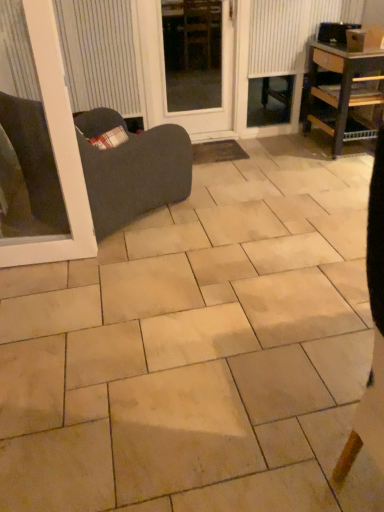
Question: From the image's perspective, does brown woven mat at center appear lower than wooden shelf at right?

Choices:
 (A) yes
 (B) no

Answer: (A)

Question: Is brown woven mat at center taller than wooden shelf at right?

Choices:
 (A) no
 (B) yes

Answer: (A)

Question: Is wooden shelf at right at the back of brown woven mat at center?

Choices:
 (A) yes
 (B) no

Answer: (B)

Question: Is brown woven mat at center not close to wooden shelf at right?

Choices:
 (A) no
 (B) yes

Answer: (A)

Question: Can you confirm if brown woven mat at center is positioned to the right of wooden shelf at right?

Choices:
 (A) no
 (B) yes

Answer: (A)

Question: Visually, is white textured radiator at upper right positioned to the left or to the right of wooden shelf at right?

Choices:
 (A) left
 (B) right

Answer: (A)

Question: Is white textured radiator at upper right wider or thinner than wooden shelf at right?

Choices:
 (A) thin
 (B) wide

Answer: (A)

Question: Is white textured radiator at upper right inside or outside of wooden shelf at right?

Choices:
 (A) outside
 (B) inside

Answer: (A)

Question: From their relative heights in the image, would you say white textured radiator at upper right is taller or shorter than wooden shelf at right?

Choices:
 (A) tall
 (B) short

Answer: (B)

Question: Considering the positions of wooden shelf at right and white textured radiator at upper right in the image, is wooden shelf at right taller or shorter than white textured radiator at upper right?

Choices:
 (A) tall
 (B) short

Answer: (A)

Question: Considering the positions of wooden shelf at right and white textured radiator at upper right in the image, is wooden shelf at right wider or thinner than white textured radiator at upper right?

Choices:
 (A) thin
 (B) wide

Answer: (B)

Question: Is point (375, 118) closer or farther from the camera than point (261, 71)?

Choices:
 (A) closer
 (B) farther

Answer: (A)

Question: Is wooden shelf at right inside the boundaries of white textured radiator at upper right, or outside?

Choices:
 (A) outside
 (B) inside

Answer: (A)

Question: Is beige ceramic tile at center in front of or behind matte white blind at upper left in the image?

Choices:
 (A) behind
 (B) front

Answer: (B)

Question: Is beige ceramic tile at center spatially inside matte white blind at upper left, or outside of it?

Choices:
 (A) inside
 (B) outside

Answer: (B)